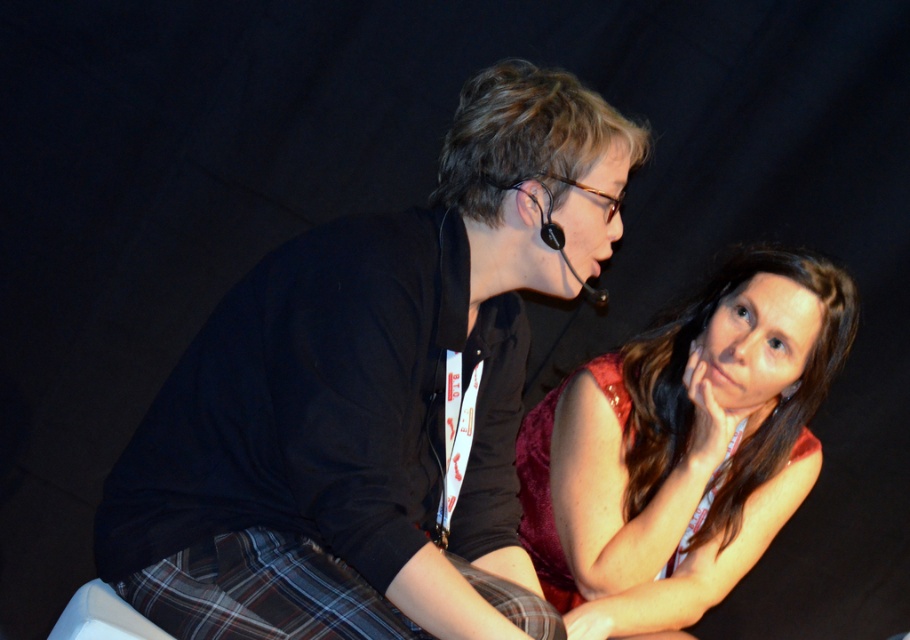
You are designing a photo frame that needs to accommodate both the black matte shirt at center and the matte red dress at center in the image. Since the frame has a fixed width, which object should be placed first to ensure both fit without overlapping?

The black matte shirt at center is larger in size than the matte red dress at center, so place the black matte shirt at center first to ensure there is enough space for both without overlapping.

You are an event planner arranging a photo shoot and need to position a red dress in the center of the image. According to the scene description, where exactly is the matte red dress at center located in coordinates?

The matte red dress at center is located at point [683,448].

You are a photographer at a formal event. You need to capture a photo of the matte red dress at center and the plaid fabric kilt at lower left. Which object should you focus on first if you want to ensure both are in focus, considering their heights?

The matte red dress at center is taller than the plaid fabric kilt at lower left. To ensure both are in focus, focus on the taller object first, which is the matte red dress at center, as it requires a greater depth of field.